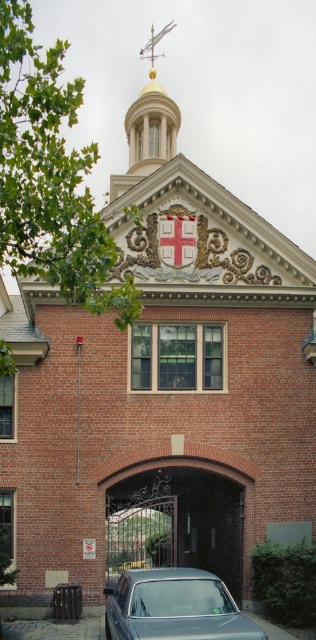
From the picture: You are a delivery driver approaching the building and need to park your metallic silver car at lower center. The parking space next to the metallic wrought iron gate at center is only 2 meters wide. Can your car fit into the space?

The metallic wrought iron gate at center is wider than the metallic silver car at lower center. Since the parking space is 2 meters wide, the metallic silver car at lower center can fit into the space as it is narrower than the gate.

You are a pedestrian standing at the sidewalk in front of the building. You want to enter through the central entrance. Is the metallic silver car at lower center blocking your path to the metallic wrought iron gate at center?

The metallic silver car at lower center is behind the metallic wrought iron gate at center, so it is not blocking the path to the gate. You can approach the gate freely.

You are a visitor approaching the building and want to enter through the entrance. Which object, the metallic wrought iron gate at center or the gold polished metal spire at upper center, is more likely to be part of the entrance structure?

The metallic wrought iron gate at center is more likely to be part of the entrance structure since it is smaller in size compared to the gold polished metal spire at upper center, which is likely a decorative element at the top of the building.